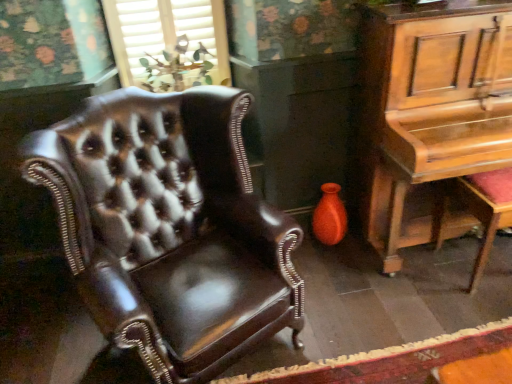
In order to click on free space to the left of red cushioned stool at right in this screenshot , I will do `click(422, 284)`.